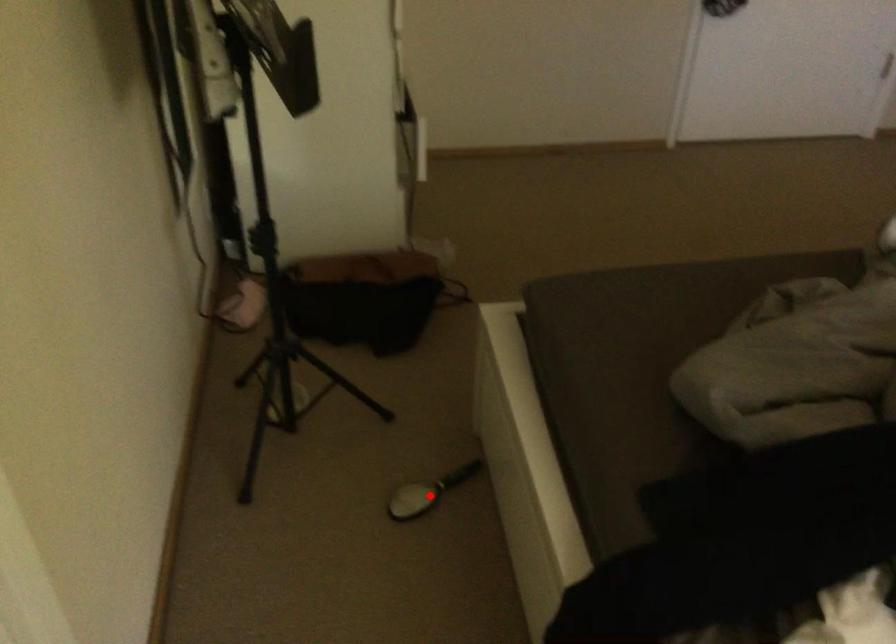
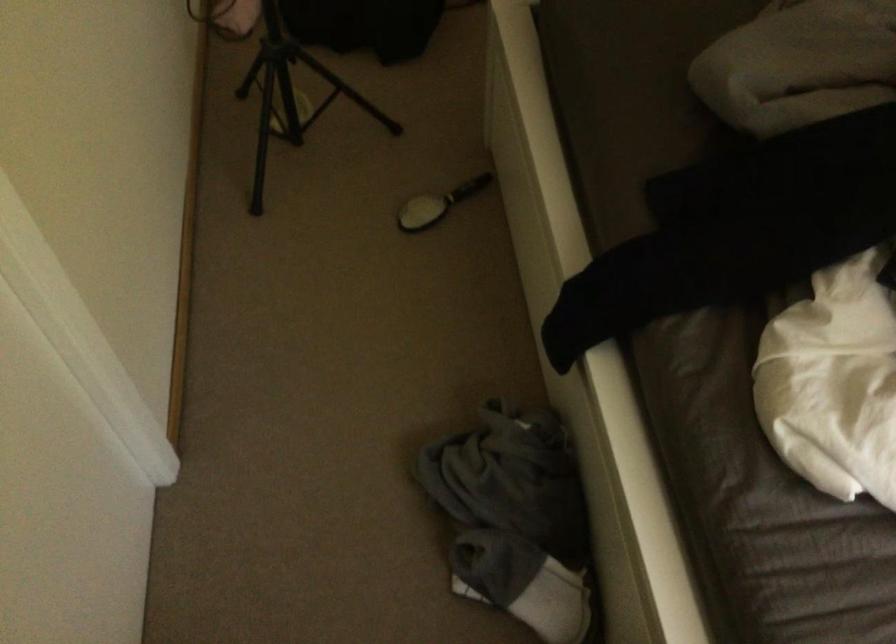
In the second image, find the point that corresponds to the highlighted location in the first image.

(437, 204)